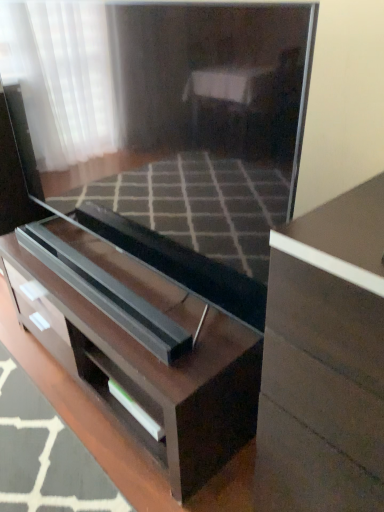
Locate an element on the screen. matte brown chest of drawers at right, the first chest of drawers viewed from the right is located at coordinates (324, 360).

Describe the element at coordinates (324, 360) in the screenshot. This screenshot has width=384, height=512. I see `matte brown chest of drawers at right, the first chest of drawers viewed from the right` at that location.

Find the location of `dark wood chest of drawers at center, which is the 2th chest of drawers in right-to-left order`. dark wood chest of drawers at center, which is the 2th chest of drawers in right-to-left order is located at coordinates (147, 375).

Describe the element at coordinates (147, 375) in the screenshot. I see `dark wood chest of drawers at center, which is the 2th chest of drawers in right-to-left order` at that location.

Measure the distance between dark wood chest of drawers at center, which is the 2th chest of drawers in right-to-left order, and camera.

A distance of 1.14 meters exists between dark wood chest of drawers at center, which is the 2th chest of drawers in right-to-left order, and camera.

Find the location of a particular element. matte brown chest of drawers at right, which is the 2th chest of drawers in left-to-right order is located at coordinates (324, 360).

Which object is positioned more to the left, dark wood chest of drawers at center, which is the 2th chest of drawers in right-to-left order, or matte brown chest of drawers at right, the first chest of drawers viewed from the right?

Positioned to the left is dark wood chest of drawers at center, which is the 2th chest of drawers in right-to-left order.

Is dark wood chest of drawers at center, the first chest of drawers from the left, in front of matte brown chest of drawers at right, which is the 2th chest of drawers in left-to-right order?

No, it is behind matte brown chest of drawers at right, which is the 2th chest of drawers in left-to-right order.

Considering the points (122, 277) and (290, 499), which point is behind, point (122, 277) or point (290, 499)?

The point (122, 277) is more distant.

From the image's perspective, which is below, dark wood chest of drawers at center, the first chest of drawers from the left, or matte brown chest of drawers at right, the first chest of drawers viewed from the right?

From the image's view, matte brown chest of drawers at right, the first chest of drawers viewed from the right, is below.

Consider the image. From a real-world perspective, between dark wood chest of drawers at center, which is the 2th chest of drawers in right-to-left order, and matte brown chest of drawers at right, the first chest of drawers viewed from the right, who is vertically higher?

matte brown chest of drawers at right, the first chest of drawers viewed from the right, is physically above.

Does dark wood chest of drawers at center, the first chest of drawers from the left, have a lesser width compared to matte brown chest of drawers at right, the first chest of drawers viewed from the right?

Incorrect, the width of dark wood chest of drawers at center, the first chest of drawers from the left, is not less than that of matte brown chest of drawers at right, the first chest of drawers viewed from the right.

Can you confirm if dark wood chest of drawers at center, the first chest of drawers from the left, is taller than matte brown chest of drawers at right, which is the 2th chest of drawers in left-to-right order?

Incorrect, the height of dark wood chest of drawers at center, the first chest of drawers from the left, is not larger of that of matte brown chest of drawers at right, which is the 2th chest of drawers in left-to-right order.

Does dark wood chest of drawers at center, which is the 2th chest of drawers in right-to-left order, have a smaller size compared to matte brown chest of drawers at right, which is the 2th chest of drawers in left-to-right order?

No, dark wood chest of drawers at center, which is the 2th chest of drawers in right-to-left order, is not smaller than matte brown chest of drawers at right, which is the 2th chest of drawers in left-to-right order.

Can matte brown chest of drawers at right, which is the 2th chest of drawers in left-to-right order, be found inside dark wood chest of drawers at center, the first chest of drawers from the left?

Actually, matte brown chest of drawers at right, which is the 2th chest of drawers in left-to-right order, is outside dark wood chest of drawers at center, the first chest of drawers from the left.

Is dark wood chest of drawers at center, which is the 2th chest of drawers in right-to-left order, far from matte brown chest of drawers at right, which is the 2th chest of drawers in left-to-right order?

No, dark wood chest of drawers at center, which is the 2th chest of drawers in right-to-left order, is in close proximity to matte brown chest of drawers at right, which is the 2th chest of drawers in left-to-right order.

Is dark wood chest of drawers at center, the first chest of drawers from the left, facing away from matte brown chest of drawers at right, which is the 2th chest of drawers in left-to-right order?

No, dark wood chest of drawers at center, the first chest of drawers from the left, is not facing away from matte brown chest of drawers at right, which is the 2th chest of drawers in left-to-right order.

How many degrees apart are the facing directions of dark wood chest of drawers at center, which is the 2th chest of drawers in right-to-left order, and matte brown chest of drawers at right, the first chest of drawers viewed from the right?

0.267 degrees separate the facing orientations of dark wood chest of drawers at center, which is the 2th chest of drawers in right-to-left order, and matte brown chest of drawers at right, the first chest of drawers viewed from the right.

Locate an element on the screen. the chest of drawers that appears above the matte brown chest of drawers at right, the first chest of drawers viewed from the right (from the image's perspective) is located at coordinates (147, 375).

Considering the relative positions of matte brown chest of drawers at right, the first chest of drawers viewed from the right, and dark wood chest of drawers at center, which is the 2th chest of drawers in right-to-left order, in the image provided, is matte brown chest of drawers at right, the first chest of drawers viewed from the right, to the left of dark wood chest of drawers at center, which is the 2th chest of drawers in right-to-left order, from the viewer's perspective?

In fact, matte brown chest of drawers at right, the first chest of drawers viewed from the right, is to the right of dark wood chest of drawers at center, which is the 2th chest of drawers in right-to-left order.

Is the position of matte brown chest of drawers at right, which is the 2th chest of drawers in left-to-right order, less distant than that of dark wood chest of drawers at center, which is the 2th chest of drawers in right-to-left order?

Yes, the depth of matte brown chest of drawers at right, which is the 2th chest of drawers in left-to-right order, is less than that of dark wood chest of drawers at center, which is the 2th chest of drawers in right-to-left order.

Does point (311, 417) appear closer or farther from the camera than point (10, 246)?

Clearly, point (311, 417) is closer to the camera than point (10, 246).

From the image's perspective, is matte brown chest of drawers at right, which is the 2th chest of drawers in left-to-right order, located above or below dark wood chest of drawers at center, which is the 2th chest of drawers in right-to-left order?

Based on their image positions, matte brown chest of drawers at right, which is the 2th chest of drawers in left-to-right order, is located beneath dark wood chest of drawers at center, which is the 2th chest of drawers in right-to-left order.

From a real-world perspective, is matte brown chest of drawers at right, which is the 2th chest of drawers in left-to-right order, positioned above or below dark wood chest of drawers at center, which is the 2th chest of drawers in right-to-left order?

matte brown chest of drawers at right, which is the 2th chest of drawers in left-to-right order, is above dark wood chest of drawers at center, which is the 2th chest of drawers in right-to-left order.

In terms of width, does matte brown chest of drawers at right, which is the 2th chest of drawers in left-to-right order, look wider or thinner when compared to dark wood chest of drawers at center, which is the 2th chest of drawers in right-to-left order?

Considering their sizes, matte brown chest of drawers at right, which is the 2th chest of drawers in left-to-right order, looks slimmer than dark wood chest of drawers at center, which is the 2th chest of drawers in right-to-left order.

Which of these two, matte brown chest of drawers at right, which is the 2th chest of drawers in left-to-right order, or dark wood chest of drawers at center, which is the 2th chest of drawers in right-to-left order, stands shorter?

dark wood chest of drawers at center, which is the 2th chest of drawers in right-to-left order.

Looking at the image, does matte brown chest of drawers at right, which is the 2th chest of drawers in left-to-right order, seem bigger or smaller compared to dark wood chest of drawers at center, the first chest of drawers from the left?

In the image, matte brown chest of drawers at right, which is the 2th chest of drawers in left-to-right order, appears to be smaller than dark wood chest of drawers at center, the first chest of drawers from the left.

Is matte brown chest of drawers at right, which is the 2th chest of drawers in left-to-right order, inside the boundaries of dark wood chest of drawers at center, the first chest of drawers from the left, or outside?

matte brown chest of drawers at right, which is the 2th chest of drawers in left-to-right order, cannot be found inside dark wood chest of drawers at center, the first chest of drawers from the left.

Is matte brown chest of drawers at right, which is the 2th chest of drawers in left-to-right order, far away from dark wood chest of drawers at center, which is the 2th chest of drawers in right-to-left order?

matte brown chest of drawers at right, which is the 2th chest of drawers in left-to-right order, is near dark wood chest of drawers at center, which is the 2th chest of drawers in right-to-left order, not far away.

Is matte brown chest of drawers at right, which is the 2th chest of drawers in left-to-right order, aimed at dark wood chest of drawers at center, the first chest of drawers from the left?

No, matte brown chest of drawers at right, which is the 2th chest of drawers in left-to-right order, is not turned towards dark wood chest of drawers at center, the first chest of drawers from the left.

The height and width of the screenshot is (512, 384). I want to click on the chest of drawers that is behind the matte brown chest of drawers at right, the first chest of drawers viewed from the right, so pyautogui.click(x=147, y=375).

Locate an element on the screen. Image resolution: width=384 pixels, height=512 pixels. chest of drawers on the right of dark wood chest of drawers at center, which is the 2th chest of drawers in right-to-left order is located at coordinates (324, 360).

Where is `the chest of drawers located underneath the matte brown chest of drawers at right, which is the 2th chest of drawers in left-to-right order (from a real-world perspective)`? Image resolution: width=384 pixels, height=512 pixels. the chest of drawers located underneath the matte brown chest of drawers at right, which is the 2th chest of drawers in left-to-right order (from a real-world perspective) is located at coordinates (147, 375).